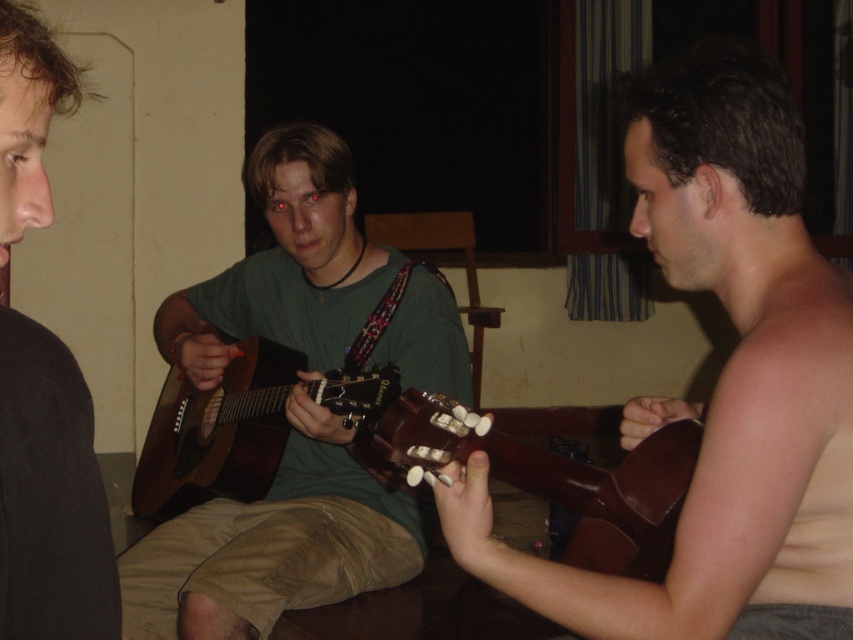
Question: Which object is positioned closest to the brown wood guitar at right?

Choices:
 (A) brown acoustic guitar at center
 (B) green matte guitar at center
 (C) black matte shirt at center

Answer: (C)

Question: Is green matte guitar at center wider than brown acoustic guitar at center?

Choices:
 (A) yes
 (B) no

Answer: (A)

Question: Which point is farther from the camera taking this photo?

Choices:
 (A) (636, 595)
 (B) (305, 403)
 (C) (16, 563)

Answer: (B)

Question: Among these points, which one is nearest to the camera?

Choices:
 (A) (4, 499)
 (B) (299, 218)

Answer: (A)

Question: Is brown wood guitar at right smaller than green matte guitar at center?

Choices:
 (A) yes
 (B) no

Answer: (A)

Question: Does brown wood guitar at right appear over black matte shirt at center?

Choices:
 (A) no
 (B) yes

Answer: (A)